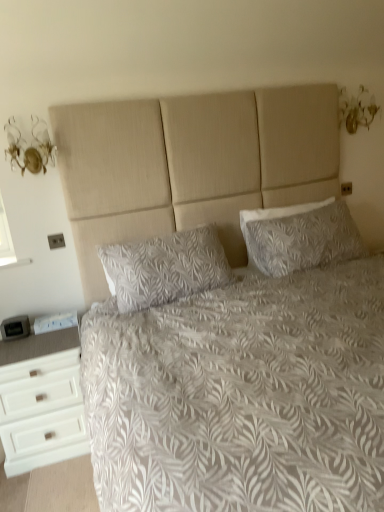
Question: Is white textured bed at center at the left side of white leaf-patterned pillow at center, the second pillow in the right-to-left sequence?

Choices:
 (A) no
 (B) yes

Answer: (A)

Question: From the image's perspective, is white textured bed at center on top of white leaf-patterned pillow at center, placed as the first pillow when sorted from left to right?

Choices:
 (A) yes
 (B) no

Answer: (B)

Question: Considering the relative positions of white textured bed at center and white leaf-patterned pillow at center, the second pillow in the right-to-left sequence, in the image provided, is white textured bed at center to the right of white leaf-patterned pillow at center, the second pillow in the right-to-left sequence, from the viewer's perspective?

Choices:
 (A) no
 (B) yes

Answer: (B)

Question: Is white leaf-patterned pillow at center, the second pillow in the right-to-left sequence, inside white textured bed at center?

Choices:
 (A) yes
 (B) no

Answer: (A)

Question: Would you say white textured bed at center is a long distance from white leaf-patterned pillow at center, the second pillow in the right-to-left sequence?

Choices:
 (A) yes
 (B) no

Answer: (B)

Question: Looking at the image, does white textured pillow at upper right, placed as the first pillow when sorted from right to left, seem bigger or smaller compared to white matte chest of drawers at lower left?

Choices:
 (A) small
 (B) big

Answer: (A)

Question: From the image's perspective, relative to white matte chest of drawers at lower left, is white textured pillow at upper right, placed as the first pillow when sorted from right to left, above or below?

Choices:
 (A) above
 (B) below

Answer: (A)

Question: Visually, is white textured pillow at upper right, acting as the second pillow starting from the left, positioned to the left or to the right of white matte chest of drawers at lower left?

Choices:
 (A) left
 (B) right

Answer: (B)

Question: Is white textured pillow at upper right, placed as the first pillow when sorted from right to left, taller or shorter than white matte chest of drawers at lower left?

Choices:
 (A) short
 (B) tall

Answer: (A)

Question: In terms of size, does white matte chest of drawers at lower left appear bigger or smaller than white leaf-patterned pillow at center, placed as the first pillow when sorted from left to right?

Choices:
 (A) small
 (B) big

Answer: (B)

Question: In the image, is white matte chest of drawers at lower left positioned in front of or behind white leaf-patterned pillow at center, the second pillow in the right-to-left sequence?

Choices:
 (A) behind
 (B) front

Answer: (B)

Question: Looking at their shapes, would you say white matte chest of drawers at lower left is wider or thinner than white leaf-patterned pillow at center, placed as the first pillow when sorted from left to right?

Choices:
 (A) thin
 (B) wide

Answer: (B)

Question: Is white matte chest of drawers at lower left inside the boundaries of white leaf-patterned pillow at center, placed as the first pillow when sorted from left to right, or outside?

Choices:
 (A) inside
 (B) outside

Answer: (B)

Question: In terms of height, does white matte chest of drawers at lower left look taller or shorter compared to white textured pillow at upper right, placed as the first pillow when sorted from right to left?

Choices:
 (A) short
 (B) tall

Answer: (B)

Question: Is point (29, 336) positioned closer to the camera than point (342, 239)?

Choices:
 (A) closer
 (B) farther

Answer: (A)